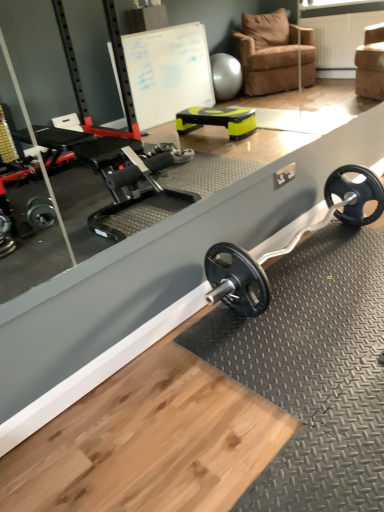
The height and width of the screenshot is (512, 384). I want to click on vacant region below polished silver barbell at center (from a real-world perspective), so click(x=309, y=260).